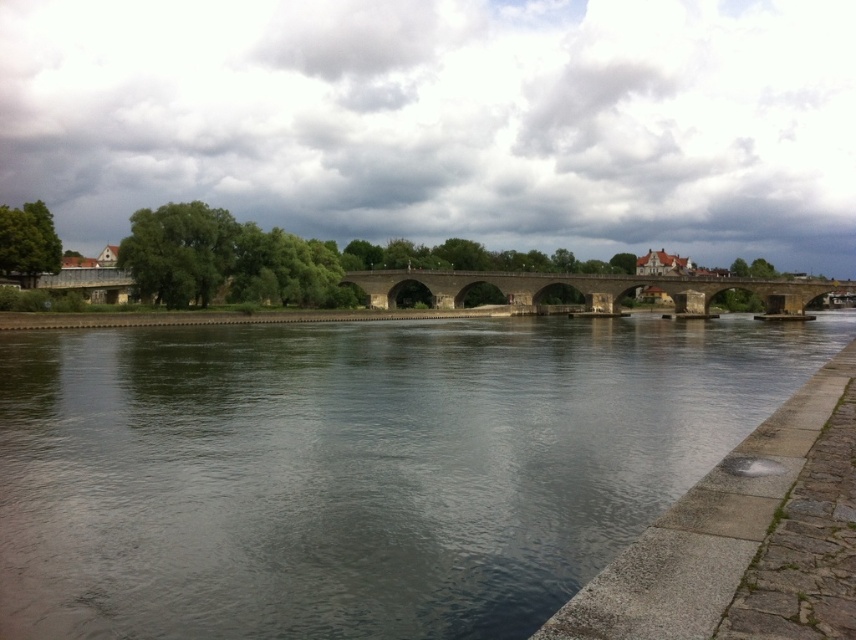
You are standing on the stone embankment on the right side of the image. You want to walk to the stone arch bridge at center. Which direction should you head towards from the dark gray water at center?

You should head to the right towards the stone arch bridge at center since the dark gray water at center is to the left of it.

You are a boat captain planning to navigate a boat through the river. The boat requires a minimum of 50 meters of clearance between the dark gray water at center and the stone arch bridge at center to safely pass under. Can the boat safely pass under the bridge?

The dark gray water at center and the stone arch bridge at center are 57.59 meters apart. Since 57.59 meters is greater than the required 50 meters, the boat can safely pass under the bridge.

You are standing at the riverside and looking at the two points marked in the image. Which point, point (646, 520) or point (521, 273), is closer to you?

Point (646, 520) is closer to you than point (521, 273).